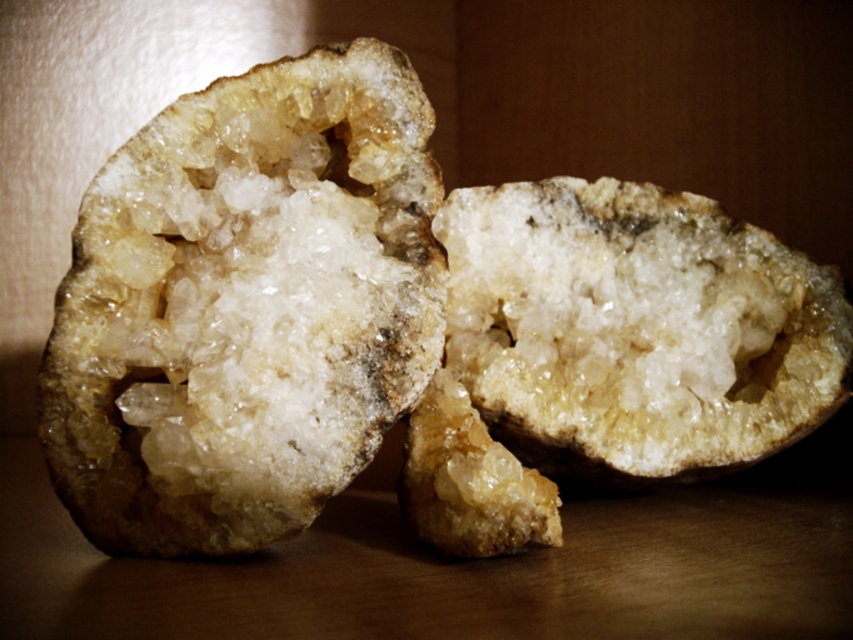
You are holding a flashlight and want to shine it on the point at coordinates point (378,216). If the flashlight has a maximum effective range of 3 feet, will it reach that point?

The distance of point (378,216) from viewer is 3.62 feet, which is beyond the flashlight effective range of 3 feet. Therefore, the flashlight will not reach the point (378,216).

You are a geologist examining the geode and its contents. You notice two translucent crystals at the center. Which one is bigger between the translucent crystal rock at center and the translucent crystal at center?

The translucent crystal rock at center has a larger size compared to the translucent crystal at center.